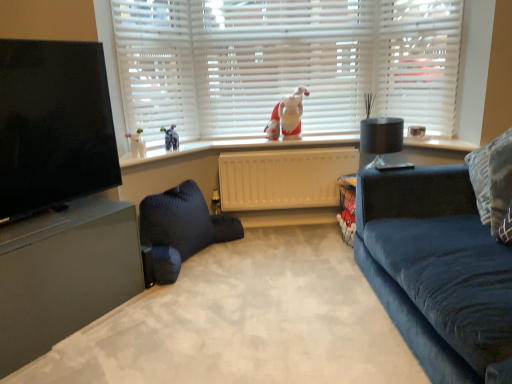
Question: Based on their sizes in the image, would you say matte gray entertainment center at left is bigger or smaller than white plastic radiator at center?

Choices:
 (A) small
 (B) big

Answer: (B)

Question: From their relative heights in the image, would you say matte gray entertainment center at left is taller or shorter than white plastic radiator at center?

Choices:
 (A) tall
 (B) short

Answer: (A)

Question: Estimate the real-world distances between objects in this image. Which object is closer to the white plastic radiator at center?

Choices:
 (A) matte black tv at left
 (B) white matte blinds at center
 (C) white plastic window frame at upper right
 (D) dark blue knitted bean bag at center
 (E) fuzzy fabric gnome at center

Answer: (E)

Question: Based on their relative distances, which object is farther from the patterned fabric pillow at right?

Choices:
 (A) white plastic window sill at center
 (B) fuzzy fabric gnome at center
 (C) velvet blue couch at right
 (D) velvet dark blue armchair at center
 (E) matte black tv at left

Answer: (E)